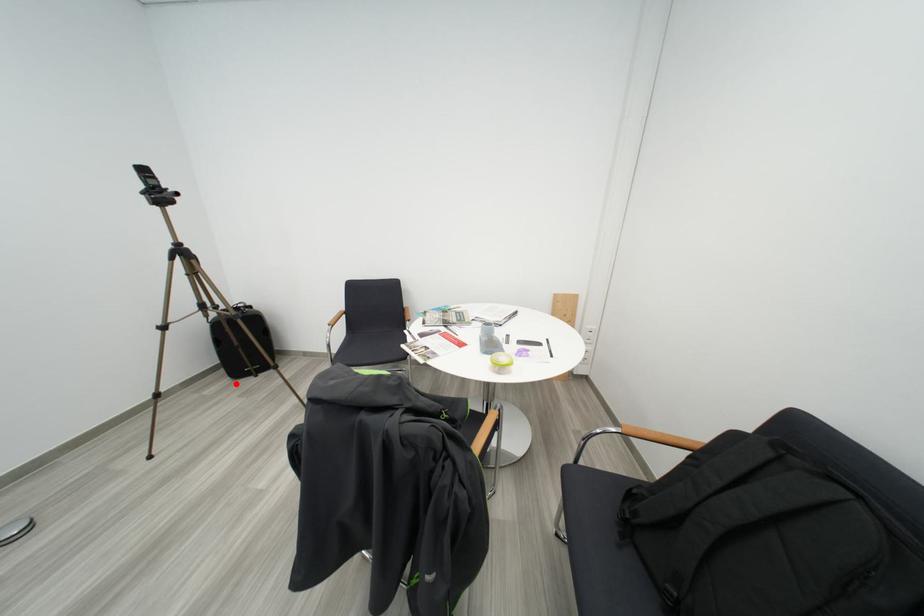
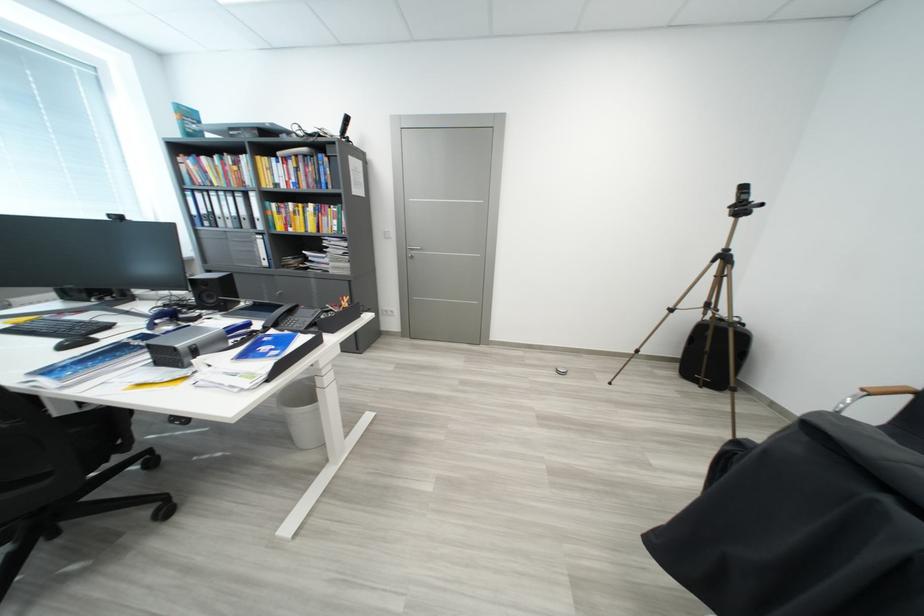
The point at the highlighted location is marked in the first image. Where is the corresponding point in the second image?

(684, 377)